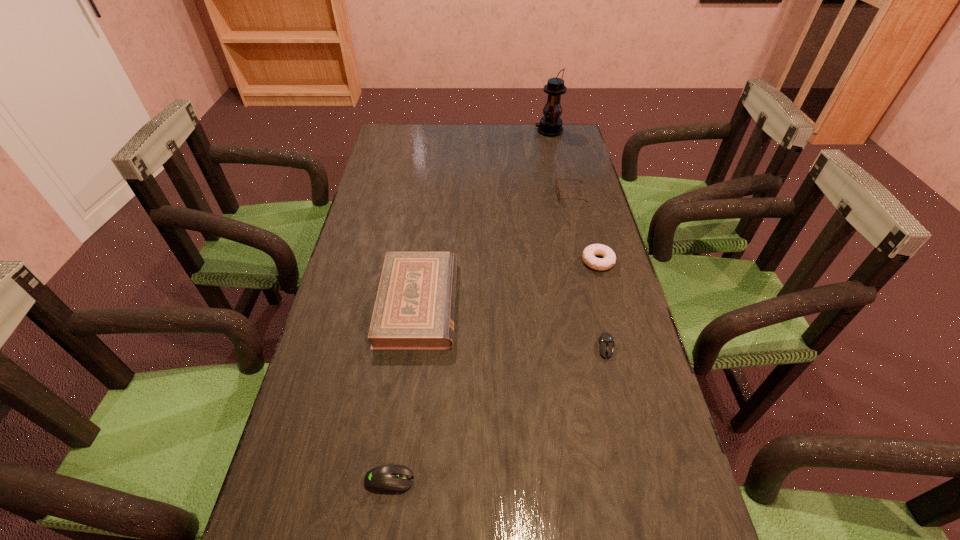
Select which object appears as the fifth closest to the nearer computer mouse. Please provide its 2D coordinates. Your answer should be formatted as a tuple, i.e. [(x, y)], where the tuple contains the x and y coordinates of a point satisfying the conditions above.

[(550, 125)]

Locate an element on the screen. Image resolution: width=960 pixels, height=540 pixels. the fourth closest object to the sunglasses is located at coordinates (606, 341).

Where is `free point that satisfies the following two spatial constraints: 1. above the right computer mouse, indicating its light source; 2. on the left side of the farthest object`? This screenshot has height=540, width=960. free point that satisfies the following two spatial constraints: 1. above the right computer mouse, indicating its light source; 2. on the left side of the farthest object is located at coordinates (597, 348).

Locate an element on the screen. The image size is (960, 540). vacant position in the image that satisfies the following two spatial constraints: 1. on the lenses of the sunglasses; 2. on the left side of the doughnut is located at coordinates click(x=586, y=261).

Find the location of `free space that satisfies the following two spatial constraints: 1. on the lenses of the doughnut; 2. on the left side of the sunglasses`. free space that satisfies the following two spatial constraints: 1. on the lenses of the doughnut; 2. on the left side of the sunglasses is located at coordinates (586, 261).

Locate an element on the screen. The width and height of the screenshot is (960, 540). vacant space that satisfies the following two spatial constraints: 1. above the doughnut, indicating its light source; 2. on the right side of the lantern is located at coordinates (578, 261).